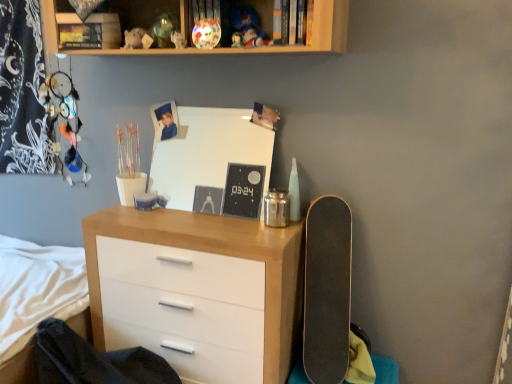
Question: Should I look upward or downward to see wooden chest of drawers at center?

Choices:
 (A) up
 (B) down

Answer: (B)

Question: Does wooden shelf at upper center contain hardcover book at upper center?

Choices:
 (A) yes
 (B) no

Answer: (A)

Question: From the image's perspective, does wooden shelf at upper center appear higher than hardcover book at upper center?

Choices:
 (A) yes
 (B) no

Answer: (A)

Question: From the image's perspective, does wooden shelf at upper center appear lower than hardcover book at upper center?

Choices:
 (A) no
 (B) yes

Answer: (A)

Question: Is wooden shelf at upper center at the left side of hardcover book at upper center?

Choices:
 (A) yes
 (B) no

Answer: (A)

Question: Is wooden shelf at upper center looking in the opposite direction of hardcover book at upper center?

Choices:
 (A) yes
 (B) no

Answer: (A)

Question: Considering the relative sizes of wooden shelf at upper center and hardcover book at upper center in the image provided, is wooden shelf at upper center thinner than hardcover book at upper center?

Choices:
 (A) yes
 (B) no

Answer: (B)

Question: Is matte white figurine at upper center bigger than black matte skateboard at right?

Choices:
 (A) yes
 (B) no

Answer: (B)

Question: From a real-world perspective, does matte white figurine at upper center stand above black matte skateboard at right?

Choices:
 (A) no
 (B) yes

Answer: (B)

Question: Can you confirm if matte white figurine at upper center is wider than black matte skateboard at right?

Choices:
 (A) yes
 (B) no

Answer: (B)

Question: Can you confirm if matte white figurine at upper center is positioned to the right of black matte skateboard at right?

Choices:
 (A) no
 (B) yes

Answer: (A)

Question: Considering the relative positions of matte white figurine at upper center and black matte skateboard at right in the image provided, is matte white figurine at upper center in front of black matte skateboard at right?

Choices:
 (A) no
 (B) yes

Answer: (A)

Question: Is matte white figurine at upper center next to black matte skateboard at right and touching it?

Choices:
 (A) yes
 (B) no

Answer: (B)

Question: From a real-world perspective, is wooden chest of drawers at center under hardcover book at upper center?

Choices:
 (A) no
 (B) yes

Answer: (B)